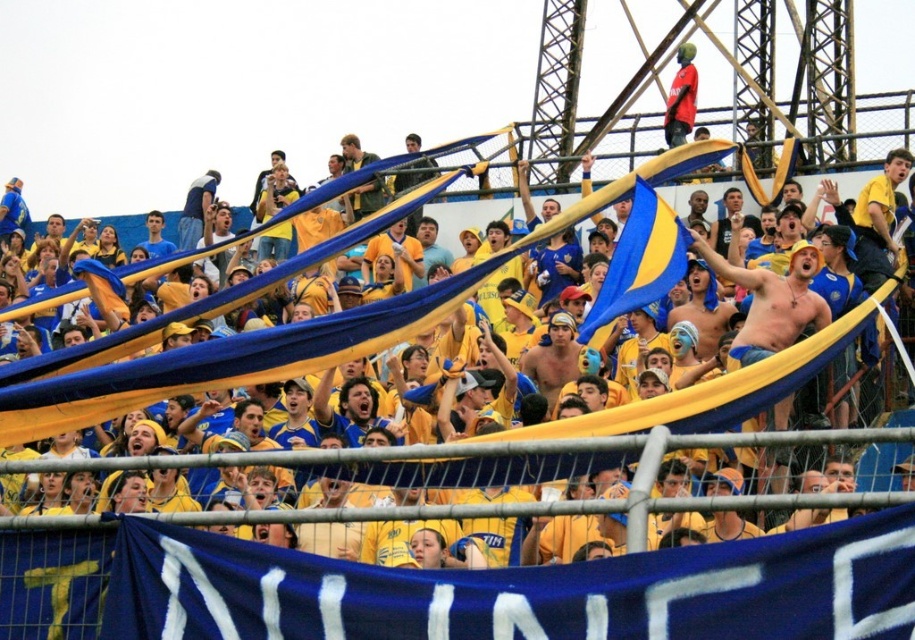
Question: Is blue/yellow fabric banner at upper center below blue/yellow fabric flag at center?

Choices:
 (A) yes
 (B) no

Answer: (A)

Question: From the image, what is the correct spatial relationship of blue/yellow fabric banner at upper center in relation to blue/yellow fabric flag at center?

Choices:
 (A) below
 (B) above

Answer: (A)

Question: In this image, where is blue/yellow fabric banner at upper center located relative to blue/yellow fabric flag at center?

Choices:
 (A) left
 (B) right

Answer: (A)